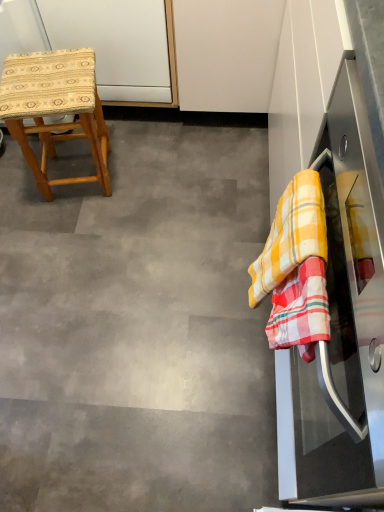
The height and width of the screenshot is (512, 384). Describe the element at coordinates (55, 109) in the screenshot. I see `wooden woven stool at left` at that location.

Describe the element at coordinates (138, 329) in the screenshot. I see `gray matte floor at center` at that location.

At what (x,y) coordinates should I click in order to perform the action: click on yellow checkered cloth at right. Please return your answer as a coordinate pair (x, y). The image size is (384, 512). Looking at the image, I should click on (291, 234).

This screenshot has width=384, height=512. Find the location of `wooden woven stool at left`. wooden woven stool at left is located at coordinates (55, 109).

Is yellow checkered cloth at right shorter than wooden woven stool at left?

Correct, yellow checkered cloth at right is not as tall as wooden woven stool at left.

Is point (264, 269) positioned in front of point (60, 124)?

Yes, point (264, 269) is in front of point (60, 124).

Considering the sizes of objects yellow checkered cloth at right and wooden woven stool at left in the image provided, who is thinner, yellow checkered cloth at right or wooden woven stool at left?

With smaller width is yellow checkered cloth at right.

Can you confirm if yellow checkered cloth at right is smaller than wooden woven stool at left?

Yes.

Does stainless steel oven at right turn towards wooden woven stool at left?

No, stainless steel oven at right is not facing towards wooden woven stool at left.

Who is smaller, stainless steel oven at right or wooden woven stool at left?

With smaller size is wooden woven stool at left.

Which object is closer to the camera taking this photo, stainless steel oven at right or wooden woven stool at left?

stainless steel oven at right is closer to the camera.

Is wooden woven stool at left facing away from yellow checkered cloth at right?

No.

Find the location of `clothe located in front of the wooden woven stool at left`. clothe located in front of the wooden woven stool at left is located at coordinates (291, 234).

Between wooden woven stool at left and yellow checkered cloth at right, which one has larger size?

wooden woven stool at left is bigger.

Considering the sizes of wooden woven stool at left and gray matte floor at center in the image, is wooden woven stool at left wider or thinner than gray matte floor at center?

Considering their sizes, wooden woven stool at left looks slimmer than gray matte floor at center.

Who is smaller, wooden woven stool at left or gray matte floor at center?

gray matte floor at center.

Is wooden woven stool at left at the left side of gray matte floor at center?

Yes.

Between wooden woven stool at left and gray matte floor at center, which one is positioned behind?

→ Positioned behind is wooden woven stool at left.

Are stainless steel oven at right and yellow checkered cloth at right far apart?

No, there isn't a large distance between stainless steel oven at right and yellow checkered cloth at right.

Does stainless steel oven at right appear on the left side of yellow checkered cloth at right?

No, stainless steel oven at right is not to the left of yellow checkered cloth at right.

Is stainless steel oven at right facing away from yellow checkered cloth at right?

Correct, stainless steel oven at right is looking away from yellow checkered cloth at right.

The width and height of the screenshot is (384, 512). Identify the location of clothe in front of the gray matte floor at center. (291, 234).

Does yellow checkered cloth at right turn towards gray matte floor at center?

No, yellow checkered cloth at right is not oriented towards gray matte floor at center.

Between yellow checkered cloth at right and gray matte floor at center, which one appears on the left side from the viewer's perspective?

gray matte floor at center is more to the left.

Is yellow checkered cloth at right not inside gray matte floor at center?

That's correct, yellow checkered cloth at right is outside of gray matte floor at center.

In terms of height, does stainless steel oven at right look taller or shorter compared to gray matte floor at center?

In the image, stainless steel oven at right appears to be taller than gray matte floor at center.

Between stainless steel oven at right and gray matte floor at center, which one has smaller width?

stainless steel oven at right.

Considering the relative positions of stainless steel oven at right and gray matte floor at center in the image provided, is stainless steel oven at right behind gray matte floor at center?

No, stainless steel oven at right is closer to the camera.

Looking at this image, how far apart are stainless steel oven at right and gray matte floor at center?

stainless steel oven at right and gray matte floor at center are 26.40 inches apart from each other.

Where is `stool located behind the yellow checkered cloth at right`? stool located behind the yellow checkered cloth at right is located at coordinates (55, 109).

Identify the location of stool that is on the left side of stainless steel oven at right. The image size is (384, 512). (55, 109).

Looking at the image, which one is located further to stainless steel oven at right, gray matte floor at center or wooden woven stool at left?

wooden woven stool at left is further to stainless steel oven at right.

Which object lies nearer to the anchor point yellow checkered cloth at right, gray matte floor at center or stainless steel oven at right?

stainless steel oven at right lies closer to yellow checkered cloth at right than the other object.

Estimate the real-world distances between objects in this image. Which object is further from wooden woven stool at left, yellow checkered cloth at right or gray matte floor at center?

Among the two, yellow checkered cloth at right is located further to wooden woven stool at left.

Considering their positions, is stainless steel oven at right positioned further to gray matte floor at center than wooden woven stool at left?

Among the two, stainless steel oven at right is located further to gray matte floor at center.

Considering their positions, is yellow checkered cloth at right positioned closer to wooden woven stool at left than stainless steel oven at right?

yellow checkered cloth at right is positioned closer to the anchor wooden woven stool at left.

Considering their positions, is stainless steel oven at right positioned further to wooden woven stool at left than yellow checkered cloth at right?

Based on the image, stainless steel oven at right appears to be further to wooden woven stool at left.

Based on their spatial positions, is yellow checkered cloth at right or wooden woven stool at left further from stainless steel oven at right?

The object further to stainless steel oven at right is wooden woven stool at left.

From the image, which object appears to be farther from yellow checkered cloth at right, gray matte floor at center or wooden woven stool at left?

The object further to yellow checkered cloth at right is wooden woven stool at left.

The image size is (384, 512). What are the coordinates of `clothe between stainless steel oven at right and wooden woven stool at left in the front-back direction` in the screenshot? It's located at (291, 234).

Where is `clothe positioned between stainless steel oven at right and gray matte floor at center from near to far`? clothe positioned between stainless steel oven at right and gray matte floor at center from near to far is located at coordinates pos(291,234).

This screenshot has width=384, height=512. Identify the location of concrete positioned between yellow checkered cloth at right and wooden woven stool at left from near to far. (138, 329).

Image resolution: width=384 pixels, height=512 pixels. Identify the location of concrete between stainless steel oven at right and wooden woven stool at left along the z-axis. (138, 329).